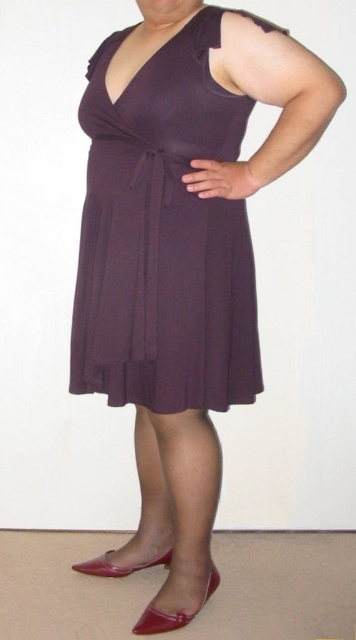
Which is more to the left, matte purple dress at center or shiny patent leather heel at lower center?

Positioned to the left is matte purple dress at center.

Who is higher up, matte purple dress at center or shiny patent leather heel at lower center?

matte purple dress at center

What do you see at coordinates (164, 237) in the screenshot?
I see `matte purple dress at center` at bounding box center [164, 237].

Find the location of a particular element. matte purple dress at center is located at coordinates (164, 237).